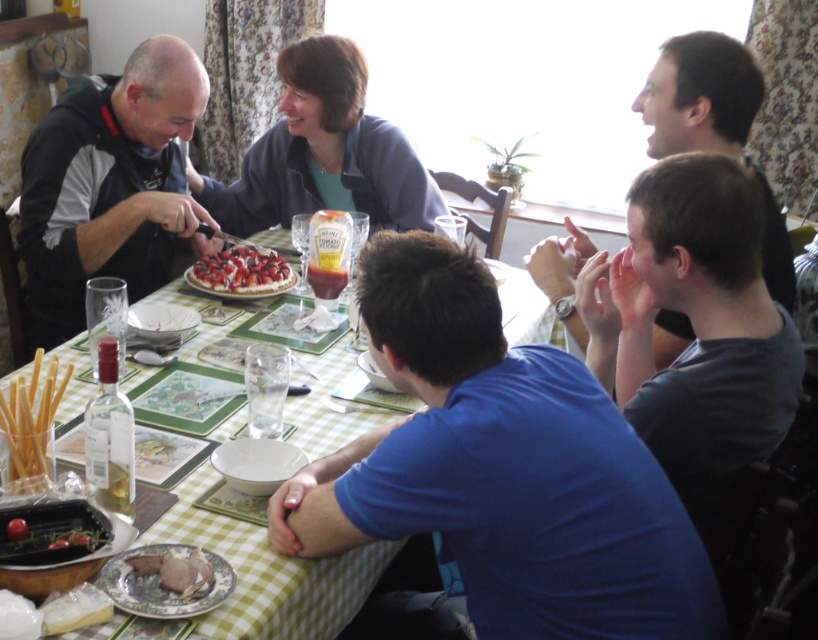
Can you confirm if matte brown meat at lower left is positioned to the right of shiny black bowl at lower left?

Indeed, matte brown meat at lower left is positioned on the right side of shiny black bowl at lower left.

Describe the element at coordinates (160, 588) in the screenshot. This screenshot has height=640, width=818. I see `matte brown meat at lower left` at that location.

Between point (221, 600) and point (27, 541), which one is positioned behind?

Positioned behind is point (27, 541).

I want to click on matte brown meat at lower left, so 160,588.

Can you confirm if strawberry-topped cake at center is smaller than dark brown meat at lower left?

No.

Who is more forward, (209, 282) or (172, 561)?

Point (172, 561) is more forward.

Which is in front, point (243, 248) or point (192, 563)?

Point (192, 563)

Image resolution: width=818 pixels, height=640 pixels. I want to click on strawberry-topped cake at center, so click(x=241, y=273).

Between gray cotton shirt at right and shiny black bowl at lower left, which one appears on the right side from the viewer's perspective?

From the viewer's perspective, gray cotton shirt at right appears more on the right side.

Who is more forward, (706, 518) or (66, 531)?

Point (66, 531) is in front.

Where is `gray cotton shirt at right`? gray cotton shirt at right is located at coordinates (695, 326).